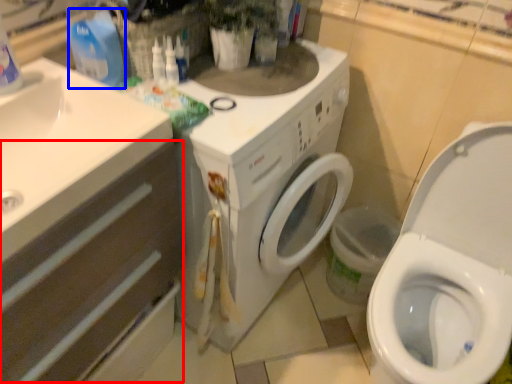
Question: Which point is further to the camera, drawer (highlighted by a red box) or cleaning product (highlighted by a blue box)?

Choices:
 (A) drawer
 (B) cleaning product

Answer: (B)